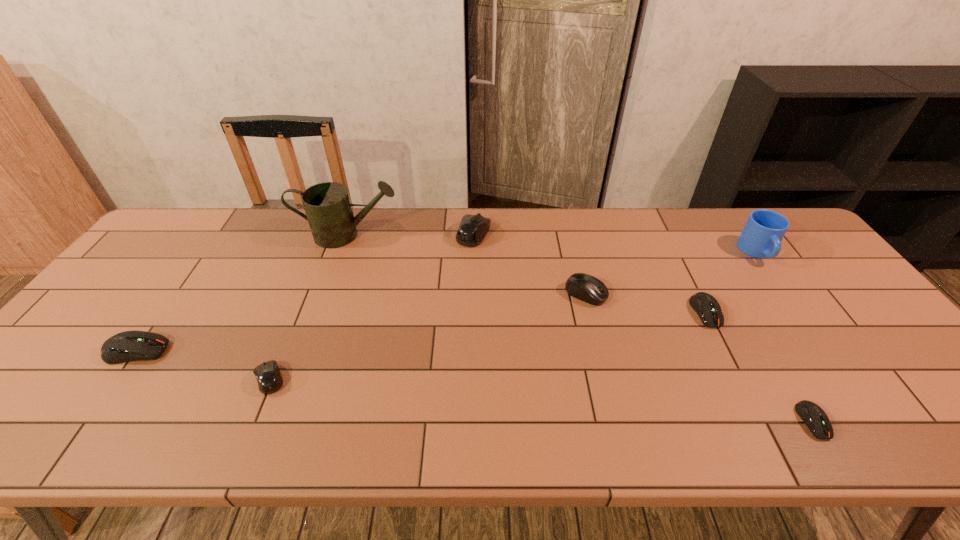
In order to click on vacant area that lies between the rightmost computer equipment and the second biggest black mouse in this screenshot , I will do point(699,357).

The width and height of the screenshot is (960, 540). Identify the location of free space between the mug and the third computer equipment from right to left. (672, 273).

At what (x,y) coordinates should I click in order to perform the action: click on blank region between the second black mouse from right to left and the green watering can. Please return your answer as a coordinate pair (x, y). Looking at the image, I should click on (411, 235).

Locate an element on the screen. This screenshot has width=960, height=540. blank region between the green watering can and the leftmost black mouse is located at coordinates (309, 307).

The width and height of the screenshot is (960, 540). What are the coordinates of `free space between the watering can and the rightmost object` in the screenshot? It's located at (553, 244).

At what (x,y) coordinates should I click in order to perform the action: click on free space between the smallest black mouse and the second smallest dark computer equipment. Please return your answer as a coordinate pair (x, y). The image size is (960, 540). Looking at the image, I should click on tap(488, 346).

This screenshot has height=540, width=960. Identify the location of the second closest object to the tallest object. (127, 346).

I want to click on object that stands as the sixth closest to the fifth computer equipment from right to left, so click(815, 418).

In order to click on computer equipment object that ranks as the fourth closest to the second dark computer equipment from right to left in this screenshot , I will do `click(269, 379)`.

Where is `the fifth closest computer equipment to the nearest computer equipment`? the fifth closest computer equipment to the nearest computer equipment is located at coordinates (127, 346).